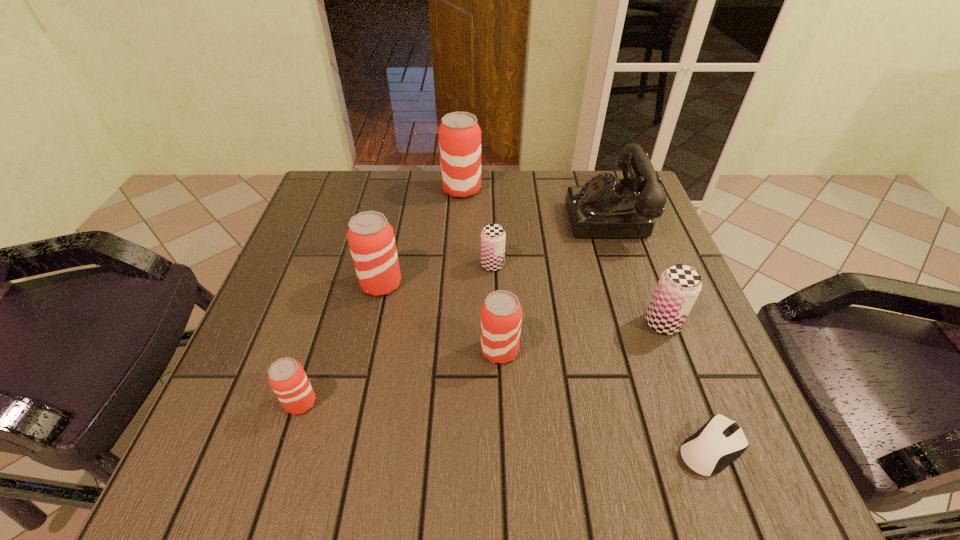
At what (x,y) coordinates should I click in order to perform the action: click on free spot between the nearer purple beer can and the seventh farthest object. Please return your answer as a coordinate pair (x, y). The height and width of the screenshot is (540, 960). Looking at the image, I should click on (482, 363).

You are a GUI agent. You are given a task and a screenshot of the screen. Output one action in this format:
    pyautogui.click(x=<x>, y=<y>)
    Task: Click on the free spot between the farthest orange beer can and the third nearest orange beer can
    The image size is (960, 540).
    Given the screenshot: What is the action you would take?
    pyautogui.click(x=421, y=237)

The image size is (960, 540). What are the coordinates of `unoccupied area between the rightmost beer can and the farther purple beer can` in the screenshot? It's located at (578, 294).

Where is `free space between the nearest beer can and the black telephone`? free space between the nearest beer can and the black telephone is located at coordinates (456, 309).

Locate an element on the screen. free spot between the mouse and the fifth shortest beer can is located at coordinates (546, 366).

In order to click on free space between the second nearest orange beer can and the bigger purple beer can in this screenshot , I will do `click(581, 337)`.

At what (x,y) coordinates should I click in order to perform the action: click on free spot between the nearer purple beer can and the third biggest orange beer can. Please return your answer as a coordinate pair (x, y). This screenshot has width=960, height=540. Looking at the image, I should click on (581, 337).

You are a GUI agent. You are given a task and a screenshot of the screen. Output one action in this format:
    pyautogui.click(x=<x>, y=<y>)
    Task: Click on the vacant space that is in between the fifth shortest beer can and the nearest object
    
    Given the screenshot: What is the action you would take?
    pyautogui.click(x=546, y=366)

Locate an element on the screen. The height and width of the screenshot is (540, 960). free point between the third farthest orange beer can and the farthest beer can is located at coordinates (481, 270).

Locate an element on the screen. This screenshot has height=540, width=960. vacant area that lies between the mouse and the second farthest orange beer can is located at coordinates pyautogui.click(x=546, y=366).